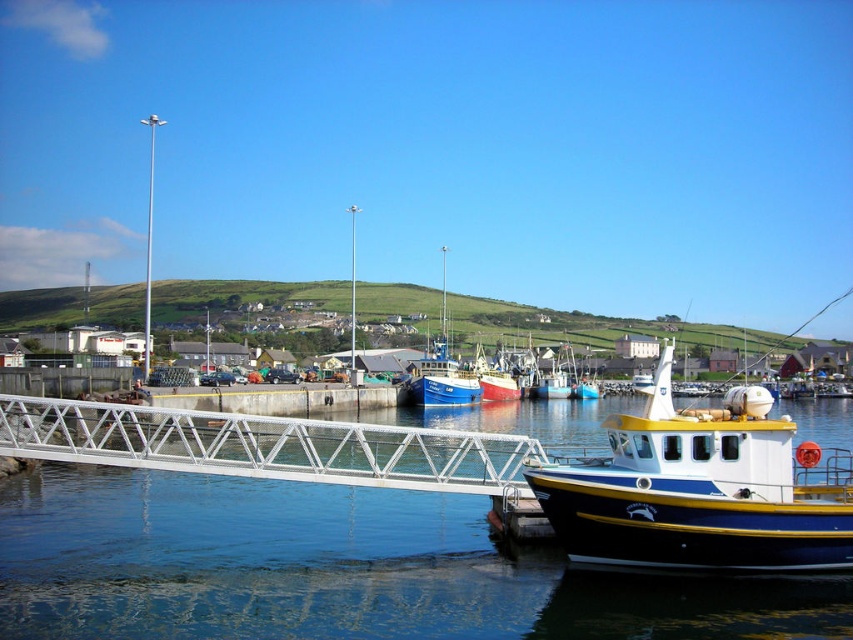
Between point (186, 556) and point (606, 532), which one is positioned in front?

Point (606, 532)

Looking at this image, is blue glossy water at lower center smaller than blue polished wood boat at lower right?

No, blue glossy water at lower center is not smaller than blue polished wood boat at lower right.

What do you see at coordinates (335, 568) in the screenshot? I see `blue glossy water at lower center` at bounding box center [335, 568].

In order to click on blue glossy water at lower center in this screenshot , I will do tap(335, 568).

Looking at this image, is blue polished wood boat at lower right thinner than concrete dock at center?

Indeed, blue polished wood boat at lower right has a lesser width compared to concrete dock at center.

Who is more distant from viewer, (843, 502) or (299, 412)?

Point (299, 412)

You are a GUI agent. You are given a task and a screenshot of the screen. Output one action in this format:
    pyautogui.click(x=<x>, y=<y>)
    Task: Click on the blue polished wood boat at lower right
    
    Given the screenshot: What is the action you would take?
    pyautogui.click(x=701, y=490)

Who is positioned more to the left, white metallic bridge at lower center or blue painted wooden fishing boat at center?

white metallic bridge at lower center is more to the left.

Is point (189, 454) positioned before point (444, 339)?

Yes, point (189, 454) is closer to viewer.

Where is `white metallic bridge at lower center`? The image size is (853, 640). white metallic bridge at lower center is located at coordinates (265, 445).